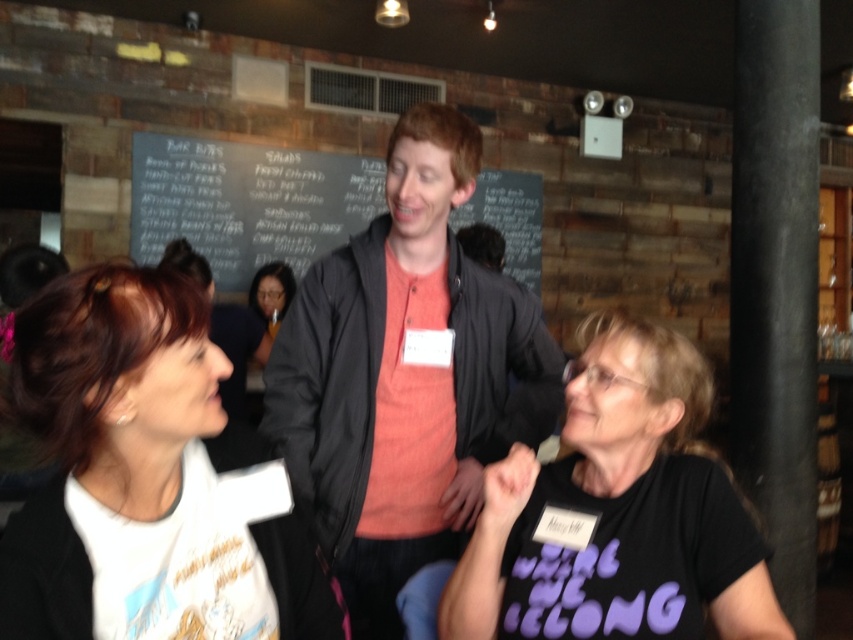
You are a photographer at the event and need to capture a photo that includes both the orange cotton shirt at center and the chalkboard at center. Based on their positions, which object should be placed on the right side of the photo to ensure both are visible?

The orange cotton shirt at center should be placed on the right side of the photo because it is already positioned on the right side of the chalkboard at center, so positioning it there will ensure both are visible in the frame.